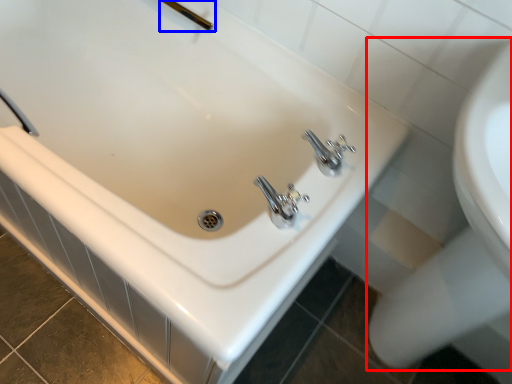
Question: Which object is further to the camera taking this photo, sink (highlighted by a red box) or shower (highlighted by a blue box)?

Choices:
 (A) sink
 (B) shower

Answer: (B)